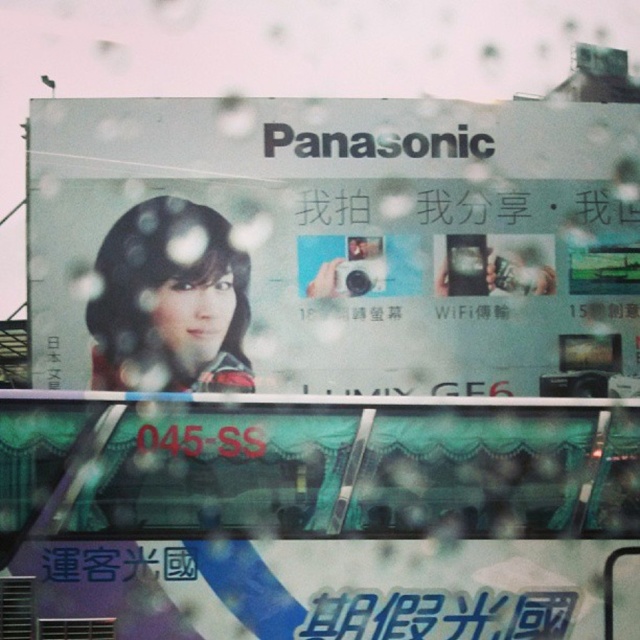
Is matte silver camera at center closer to camera compared to teal fabric covered bus at lower center?

No, matte silver camera at center is further to the viewer.

Can you confirm if matte silver camera at center is positioned to the left of teal fabric covered bus at lower center?

In fact, matte silver camera at center is to the right of teal fabric covered bus at lower center.

Which is in front, point (294, 131) or point (67, 528)?

Point (67, 528)

Locate an element on the screen. Image resolution: width=640 pixels, height=640 pixels. matte silver camera at center is located at coordinates coord(333,244).

How much distance is there between teal fabric covered bus at lower center and white glossy text at lower center?

teal fabric covered bus at lower center and white glossy text at lower center are 16.04 inches apart.

Who is higher up, teal fabric covered bus at lower center or white glossy text at lower center?

Positioned higher is teal fabric covered bus at lower center.

Between point (180, 634) and point (324, 634), which one is positioned in front?

Positioned in front is point (180, 634).

Identify the location of teal fabric covered bus at lower center. (324, 515).

Between point (269, 129) and point (496, 593), which one is positioned in front?

Point (496, 593) is more forward.

Based on the photo, is matte silver camera at center smaller than white glossy text at lower center?

No, matte silver camera at center is not smaller than white glossy text at lower center.

From the picture: Measure the distance between matte silver camera at center and camera.

36.73 feet

In order to click on matte silver camera at center in this screenshot , I will do `click(333, 244)`.